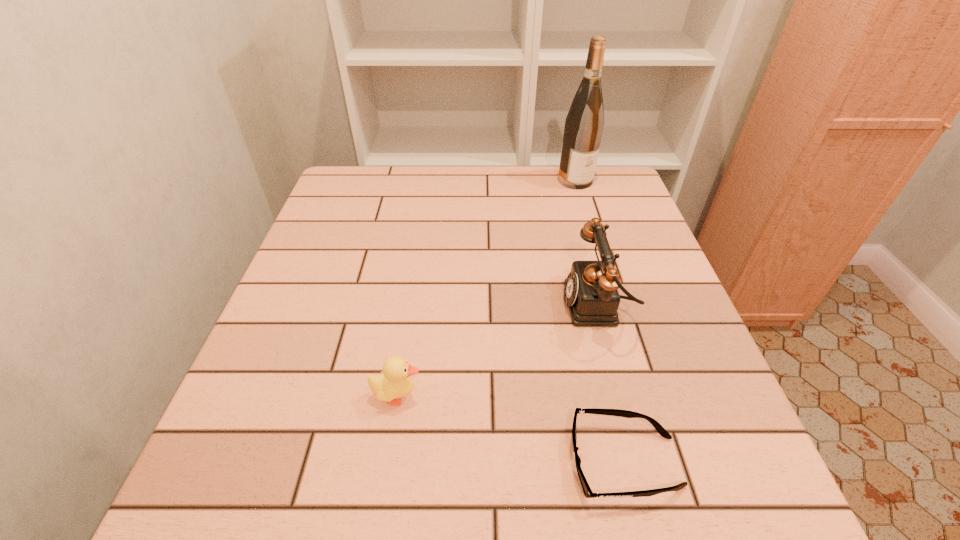
Identify the location of free space between the telephone and the tallest object. Image resolution: width=960 pixels, height=540 pixels. (586, 243).

Find the location of a particular element. This screenshot has height=540, width=960. unoccupied area between the third nearest object and the third tallest object is located at coordinates (497, 350).

The height and width of the screenshot is (540, 960). In order to click on vacant space in between the telephone and the shortest object in this screenshot , I will do `click(611, 384)`.

Locate an element on the screen. This screenshot has width=960, height=540. vacant space that's between the tallest object and the third nearest object is located at coordinates (586, 243).

At what (x,y) coordinates should I click in order to perform the action: click on blank region between the telephone and the second nearest object. Please return your answer as a coordinate pair (x, y). This screenshot has height=540, width=960. Looking at the image, I should click on pos(497,350).

Locate an element on the screen. Image resolution: width=960 pixels, height=540 pixels. free point between the second shortest object and the sunglasses is located at coordinates (511, 429).

Where is `free spot between the sunglasses and the duckling`? Image resolution: width=960 pixels, height=540 pixels. free spot between the sunglasses and the duckling is located at coordinates (511, 429).

Locate an element on the screen. Image resolution: width=960 pixels, height=540 pixels. empty location between the third shortest object and the duckling is located at coordinates (497, 350).

Find the location of a particular element. The image size is (960, 540). free space between the second tallest object and the sunglasses is located at coordinates (611, 384).

Identify which object is located as the second nearest to the second nearest object. Please provide its 2D coordinates. Your answer should be formatted as a tuple, i.e. [(x, y)], where the tuple contains the x and y coordinates of a point satisfying the conditions above.

[(592, 296)]